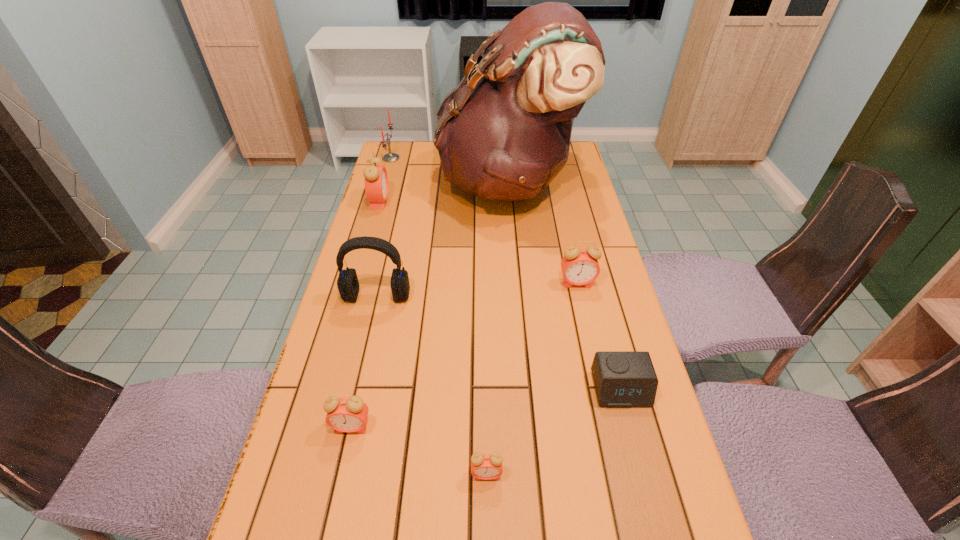
Identify which alarm clock is the fourth closest to the third nearest object. Please provide its 2D coordinates. Your answer should be formatted as a tuple, i.e. [(x, y)], where the tuple contains the x and y coordinates of a point satisfying the conditions above.

[(376, 180)]

The width and height of the screenshot is (960, 540). I want to click on pink alarm clock that stands as the second closest to the headset, so click(376, 180).

Identify the location of the third closest pink alarm clock to the third tallest alarm clock. (376, 180).

You are a GUI agent. You are given a task and a screenshot of the screen. Output one action in this format:
    pyautogui.click(x=<x>, y=<y>)
    Task: Click on the vacant point that satisfies the following two spatial constraints: 1. at the front of the satchel with buckles; 2. on the headband of the headset
    
    Given the screenshot: What is the action you would take?
    pyautogui.click(x=517, y=296)